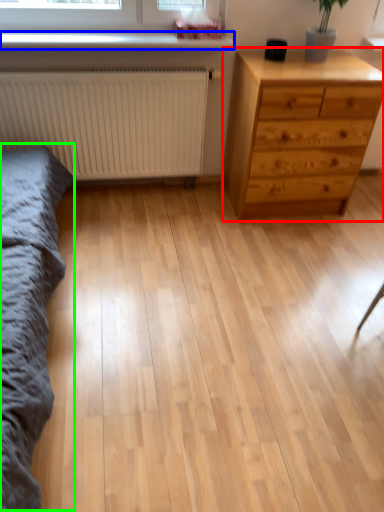
Question: Considering the real-world distances, which object is farthest from chest of drawers (highlighted by a red box)? window sill (highlighted by a blue box) or bed frame (highlighted by a green box)?

Choices:
 (A) window sill
 (B) bed frame

Answer: (B)